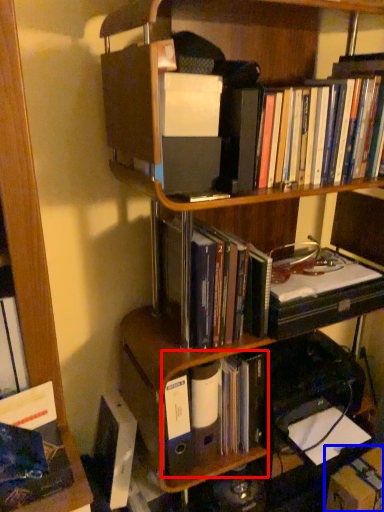
Question: Which object is further to the camera taking this photo, book (highlighted by a red box) or cardboard box (highlighted by a blue box)?

Choices:
 (A) book
 (B) cardboard box

Answer: (B)